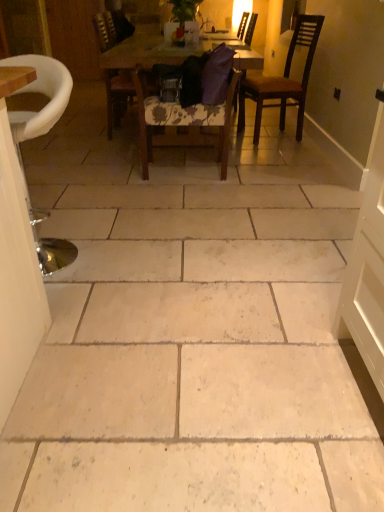
Locate an element on the screen. The height and width of the screenshot is (512, 384). vacant space to the right of floral fabric chair at center, the 2th chair viewed from the front is located at coordinates (256, 173).